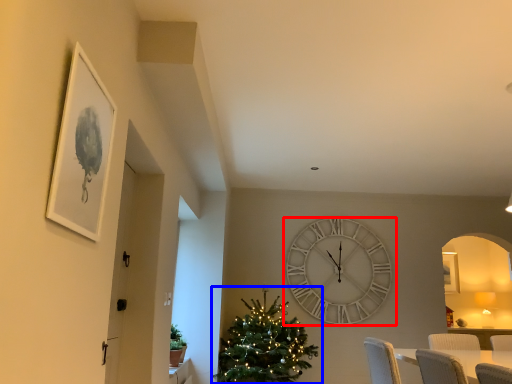
Question: Among these objects, which one is farthest to the camera, wall clock (highlighted by a red box) or christmas tree (highlighted by a blue box)?

Choices:
 (A) wall clock
 (B) christmas tree

Answer: (A)